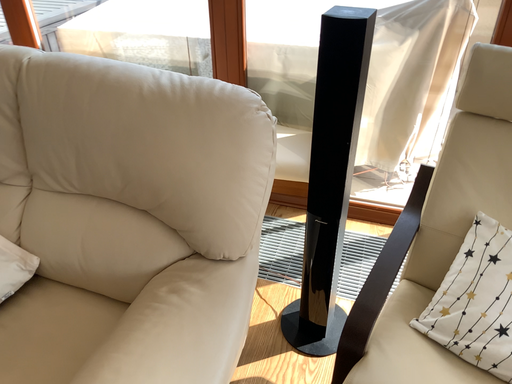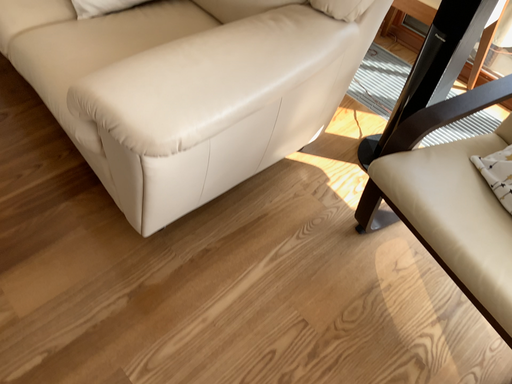
Question: Which way did the camera rotate in the video?

Choices:
 (A) rotated right
 (B) rotated left

Answer: (B)